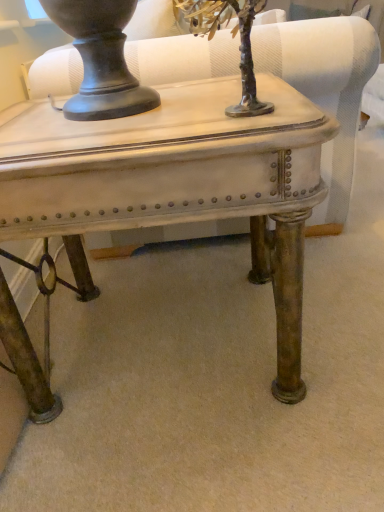
Locate an element on the screen. vacant space behind metallic silver tree at upper center is located at coordinates (210, 86).